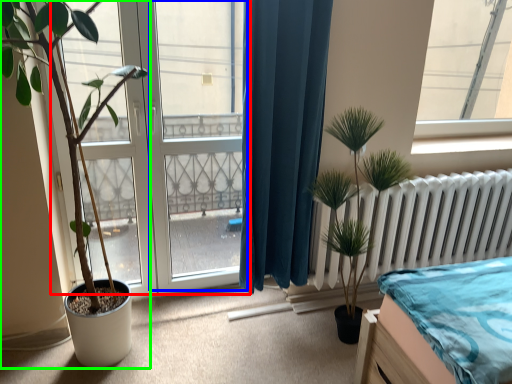
Question: Which object is the farthest from bay window (highlighted by a red box)? Choose among these: screen door (highlighted by a blue box) or houseplant (highlighted by a green box).

Choices:
 (A) screen door
 (B) houseplant

Answer: (B)